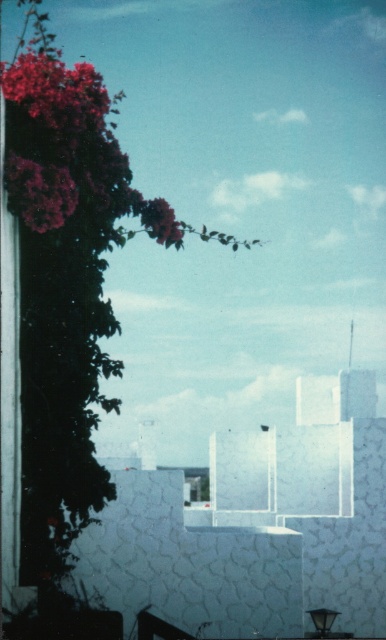
You are standing in the outdoor scene and want to walk from the point at coordinates point [162,218] to the point at coordinates point [162,224]. Which direction should you move to reach your destination?

Since point [162,224] is behind point [162,218], you should move backward to reach the destination.

You are a drone operator trying to locate a specific flower in an outdoor area. The flower you are looking for is the matte purple flower at upper left. According to the coordinates provided, where exactly is this flower located?

The matte purple flower at upper left is located at coordinates point [38,193].